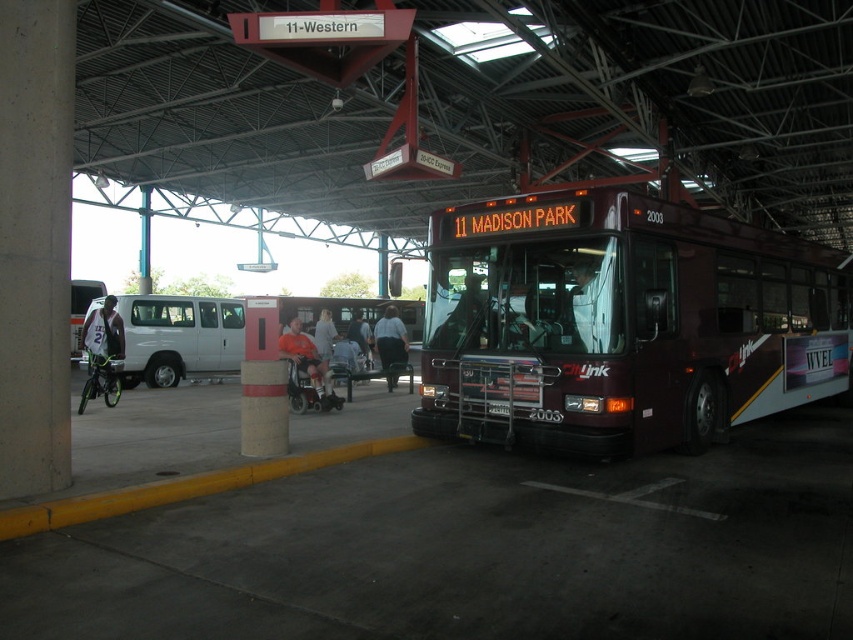
Who is positioned more to the right, white matte van at left or dark gray jacket at center?

From the viewer's perspective, dark gray jacket at center appears more on the right side.

Is white matte van at left wider than dark gray jacket at center?

Incorrect, white matte van at left's width does not surpass dark gray jacket at center's.

What do you see at coordinates (178, 337) in the screenshot?
I see `white matte van at left` at bounding box center [178, 337].

Where is `white matte van at left`? The height and width of the screenshot is (640, 853). white matte van at left is located at coordinates (178, 337).

Is green metallic bicycle at left in front of orange shirt at center?

Yes, it is in front of orange shirt at center.

Is green metallic bicycle at left thinner than orange shirt at center?

Yes, green metallic bicycle at left is thinner than orange shirt at center.

Where is `green metallic bicycle at left`? The image size is (853, 640). green metallic bicycle at left is located at coordinates (102, 346).

The width and height of the screenshot is (853, 640). Find the location of `green metallic bicycle at left`. green metallic bicycle at left is located at coordinates (102, 346).

Between point (160, 312) and point (611, 310), which one is positioned behind?

Point (160, 312)

Locate an element on the screen. This screenshot has width=853, height=640. white matte van at left is located at coordinates (178, 337).

You are a GUI agent. You are given a task and a screenshot of the screen. Output one action in this format:
    pyautogui.click(x=<x>, y=<y>)
    Task: Click on the white matte van at left
    This screenshot has width=853, height=640.
    Given the screenshot: What is the action you would take?
    pyautogui.click(x=178, y=337)

At what (x,y) coordinates should I click in order to perform the action: click on white matte van at left. Please return your answer as a coordinate pair (x, y). Looking at the image, I should click on (178, 337).